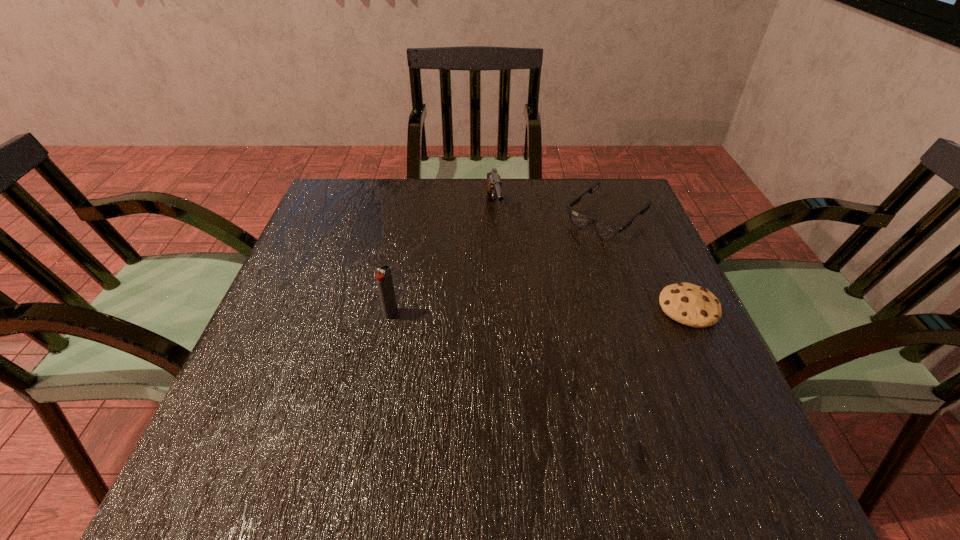
Find the location of `free space located at the barrel of the pistol`. free space located at the barrel of the pistol is located at coordinates (504, 269).

Identify the location of blank space located 0.250m at the barrel of the pistol. (512, 303).

Find the location of a particular element. The width and height of the screenshot is (960, 540). sunglasses at the far edge is located at coordinates (606, 231).

The width and height of the screenshot is (960, 540). What are the coordinates of `pistol that is at the far edge` in the screenshot? It's located at [493, 190].

This screenshot has width=960, height=540. Find the location of `cookie at the right edge`. cookie at the right edge is located at coordinates (692, 305).

I want to click on sunglasses at the right edge, so click(x=606, y=231).

At what (x,y) coordinates should I click in order to perform the action: click on object that is at the far right corner. Please return your answer as a coordinate pair (x, y). Looking at the image, I should click on (606, 231).

I want to click on vacant space at the far edge, so click(469, 178).

At what (x,y) coordinates should I click in order to perform the action: click on vacant space at the left edge of the desktop. Please return your answer as a coordinate pair (x, y). Looking at the image, I should click on (335, 253).

Find the location of a particular element. free region at the right edge of the desktop is located at coordinates (652, 334).